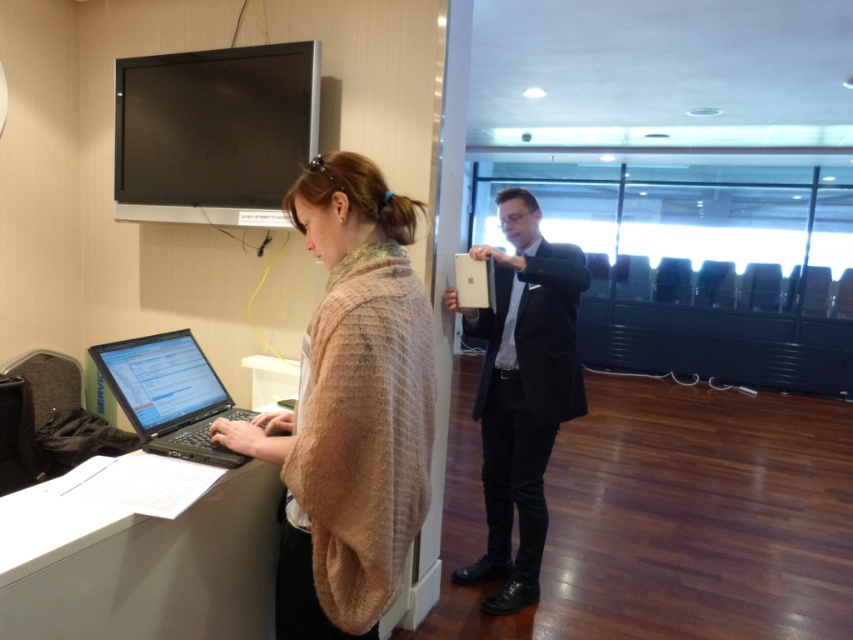
Does beige knitted shawl at center lie in front of matte black suit at center?

Yes, beige knitted shawl at center is in front of matte black suit at center.

What are the coordinates of `beige knitted shawl at center` in the screenshot? It's located at (350, 408).

Does point (334, 218) lie in front of point (468, 321)?

Yes.

This screenshot has width=853, height=640. What are the coordinates of `beige knitted shawl at center` in the screenshot? It's located at (350, 408).

Can you confirm if matte black suit at center is smaller than black matte laptop at left?

No, matte black suit at center is not smaller than black matte laptop at left.

Between matte black suit at center and black matte laptop at left, which one is positioned lower?

Positioned lower is matte black suit at center.

Who is more distant from viewer, (509, 224) or (190, 387)?

Positioned behind is point (509, 224).

Image resolution: width=853 pixels, height=640 pixels. In order to click on matte black suit at center in this screenshot , I will do `click(521, 392)`.

Looking at this image, can you confirm if beige knitted shawl at center is thinner than black matte laptop at left?

In fact, beige knitted shawl at center might be wider than black matte laptop at left.

Is point (331, 596) positioned before point (96, 362)?

Yes, it is.

You are a GUI agent. You are given a task and a screenshot of the screen. Output one action in this format:
    pyautogui.click(x=<x>, y=<y>)
    Task: Click on the beige knitted shawl at center
    
    Given the screenshot: What is the action you would take?
    pyautogui.click(x=350, y=408)